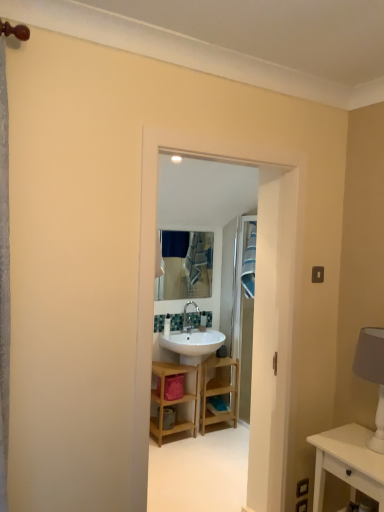
Question: Is white fabric lampshade at right situated inside wooden shelf at center or outside?

Choices:
 (A) outside
 (B) inside

Answer: (A)

Question: Considering the relative positions of white fabric lampshade at right and wooden shelf at center in the image provided, is white fabric lampshade at right to the left or to the right of wooden shelf at center?

Choices:
 (A) right
 (B) left

Answer: (A)

Question: Estimate the real-world distances between objects in this image. Which object is farther from the white fabric lampshade at right?

Choices:
 (A) white glossy sink at center
 (B) white wood side table at lower right
 (C) wooden shelf at center
 (D) metallic silver mirror at center
 (E) wooden shelf at center

Answer: (D)

Question: Estimate the real-world distances between objects in this image. Which object is closer to the white wood side table at lower right?

Choices:
 (A) blue fabric laundry at center
 (B) white fabric lampshade at right
 (C) wooden shelf at center
 (D) white glossy sink at center
 (E) wooden shelf at center

Answer: (B)